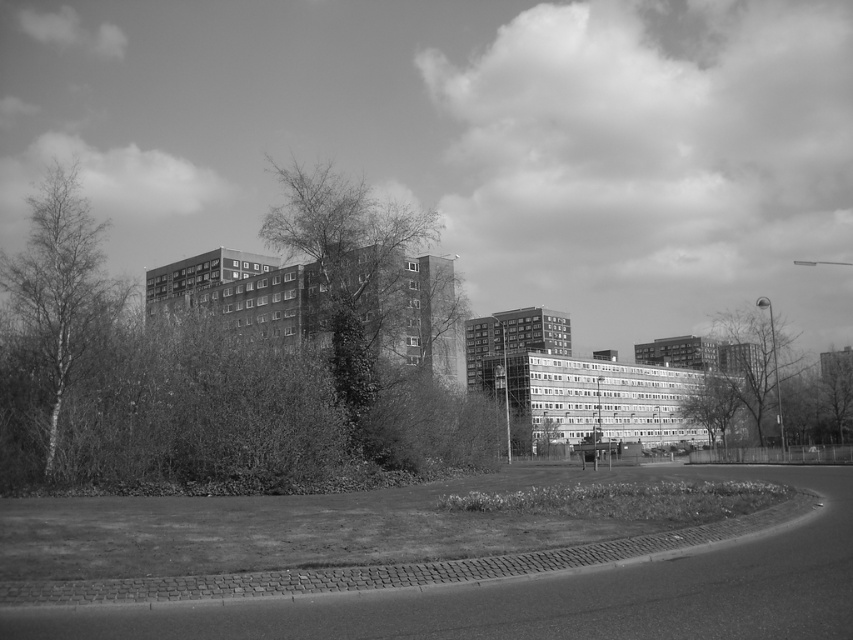
Which is more to the right, thick textured foliage at center or bare birch tree at left?

From the viewer's perspective, thick textured foliage at center appears more on the right side.

This screenshot has width=853, height=640. I want to click on thick textured foliage at center, so click(361, 282).